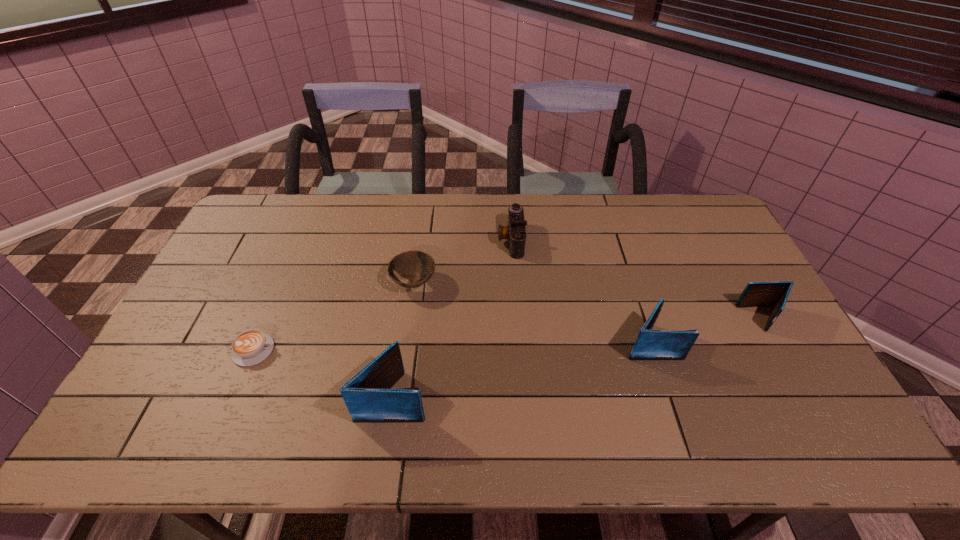
Identify the location of vacant space that's between the second farthest object and the farthest object. (463, 261).

Locate an element on the screen. unoccupied area between the second object from right to left and the camera is located at coordinates [581, 291].

Locate an element on the screen. empty location between the cappuccino and the rightmost object is located at coordinates (509, 334).

Where is `free space between the nearest wallet and the leftmost object`? Image resolution: width=960 pixels, height=540 pixels. free space between the nearest wallet and the leftmost object is located at coordinates (324, 373).

You are a GUI agent. You are given a task and a screenshot of the screen. Output one action in this format:
    pyautogui.click(x=<x>, y=<y>)
    Task: Click on the vacant area that lies between the nearest object and the cappuccino
    The height and width of the screenshot is (540, 960).
    Given the screenshot: What is the action you would take?
    pyautogui.click(x=324, y=373)

Where is `free space that is in between the second object from right to left and the bowl`? This screenshot has width=960, height=540. free space that is in between the second object from right to left and the bowl is located at coordinates (533, 313).

You are a GUI agent. You are given a task and a screenshot of the screen. Output one action in this format:
    pyautogui.click(x=<x>, y=<y>)
    Task: Click on the unoccupied area between the cappuccino and the camera
    The height and width of the screenshot is (540, 960).
    Given the screenshot: What is the action you would take?
    pyautogui.click(x=383, y=295)

Locate an element on the screen. This screenshot has height=540, width=960. vacant area that lies between the farthest object and the second wallet from right to left is located at coordinates (581, 291).

Where is `empty location between the second farthest object and the rightmost wallet`? This screenshot has height=540, width=960. empty location between the second farthest object and the rightmost wallet is located at coordinates (588, 301).

This screenshot has width=960, height=540. Find the location of `free spot between the shortest wallet and the third object from right to left`. free spot between the shortest wallet and the third object from right to left is located at coordinates (637, 279).